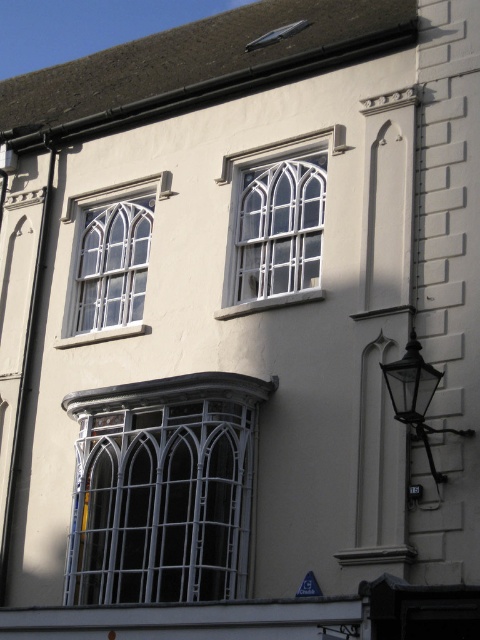
You are standing in front of the building and notice the white glass window at upper center and the black glass lamp at right. Which object is located higher up?

The white glass window at upper center is positioned over the black glass lamp at right, so it is higher up.

You are an architect reviewing the building facade. The coordinate system starts at the bottom left corner of the image with x increasing to the right and y increasing upwards. Can you confirm the exact 2D coordinates of the white glass window at upper left?

The white glass window at upper left is located at the 2D coordinates of point (109, 260).